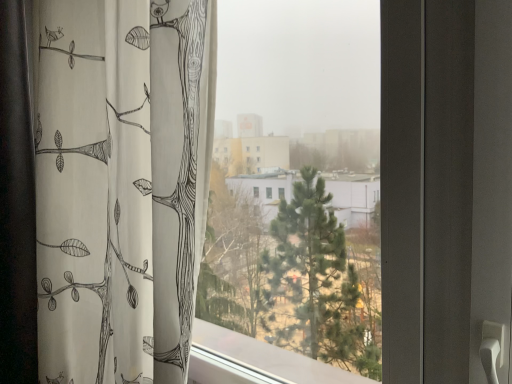
Question: Is transparent glass window at center closer to the viewer compared to white fabric curtain at left?

Choices:
 (A) yes
 (B) no

Answer: (A)

Question: Is there a large distance between transparent glass window at center and white fabric curtain at left?

Choices:
 (A) yes
 (B) no

Answer: (B)

Question: Is transparent glass window at center further to camera compared to white fabric curtain at left?

Choices:
 (A) yes
 (B) no

Answer: (B)

Question: Is white fabric curtain at left located within transparent glass window at center?

Choices:
 (A) yes
 (B) no

Answer: (B)

Question: Considering the relative positions of transparent glass window at center and white fabric curtain at left in the image provided, is transparent glass window at center to the right of white fabric curtain at left from the viewer's perspective?

Choices:
 (A) no
 (B) yes

Answer: (B)

Question: Does transparent glass window at center have a smaller size compared to white fabric curtain at left?

Choices:
 (A) no
 (B) yes

Answer: (B)

Question: Considering the relative sizes of white fabric curtain at left and transparent glass window at center in the image provided, is white fabric curtain at left smaller than transparent glass window at center?

Choices:
 (A) yes
 (B) no

Answer: (B)

Question: Is white fabric curtain at left looking in the opposite direction of transparent glass window at center?

Choices:
 (A) yes
 (B) no

Answer: (A)

Question: Is white fabric curtain at left next to transparent glass window at center?

Choices:
 (A) yes
 (B) no

Answer: (B)

Question: Can you confirm if white fabric curtain at left is taller than transparent glass window at center?

Choices:
 (A) yes
 (B) no

Answer: (A)

Question: From the image's perspective, does white fabric curtain at left appear lower than transparent glass window at center?

Choices:
 (A) no
 (B) yes

Answer: (B)

Question: Is the position of white fabric curtain at left more distant than that of transparent glass window at center?

Choices:
 (A) no
 (B) yes

Answer: (B)

Question: From a real-world perspective, is transparent glass window at center above or below white fabric curtain at left?

Choices:
 (A) above
 (B) below

Answer: (B)